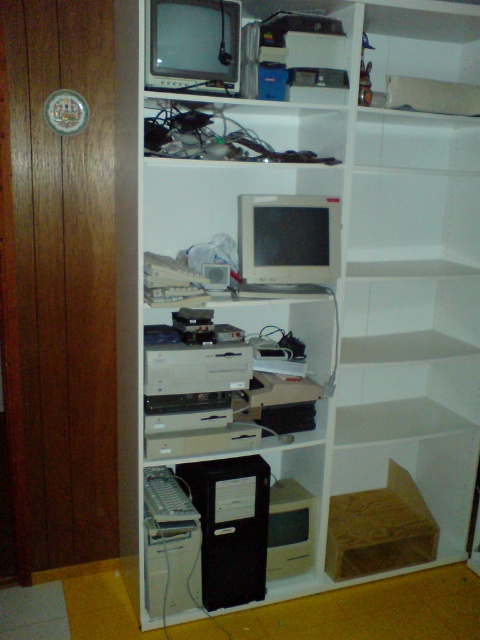
Is white matte bookshelf at center positioned before matte gray monitor at center?

Yes, white matte bookshelf at center is in front of matte gray monitor at center.

Is white matte bookshelf at center above matte gray monitor at center?

No, white matte bookshelf at center is not above matte gray monitor at center.

Is point (448, 282) less distant than point (250, 244)?

No.

Image resolution: width=480 pixels, height=640 pixels. I want to click on white matte bookshelf at center, so click(301, 312).

Is black plastic computer tower at center to the left of matte gray monitor at center from the viewer's perspective?

Correct, you'll find black plastic computer tower at center to the left of matte gray monitor at center.

Can you confirm if black plastic computer tower at center is smaller than matte gray monitor at center?

No, black plastic computer tower at center is not smaller than matte gray monitor at center.

At what (x,y) coordinates should I click in order to perform the action: click on black plastic computer tower at center. Please return your answer as a coordinate pair (x, y). Image resolution: width=480 pixels, height=640 pixels. Looking at the image, I should click on (230, 525).

Locate an element on the screen. black plastic computer tower at center is located at coordinates (230, 525).

Does white matte bookshelf at center appear under black plastic computer tower at center?

No, white matte bookshelf at center is not below black plastic computer tower at center.

What do you see at coordinates (301, 312) in the screenshot? I see `white matte bookshelf at center` at bounding box center [301, 312].

Is point (460, 360) farther from camera compared to point (207, 593)?

That is True.

Find the location of a particular element. This screenshot has height=640, width=480. white matte bookshelf at center is located at coordinates (301, 312).